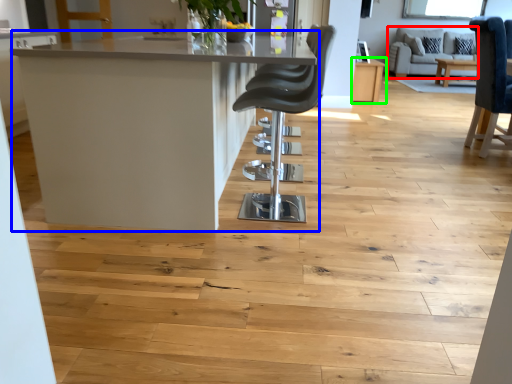
Question: Which object is positioned farthest from couch (highlighted by a red box)? Select from table (highlighted by a blue box) and table (highlighted by a green box).

Choices:
 (A) table
 (B) table

Answer: (A)